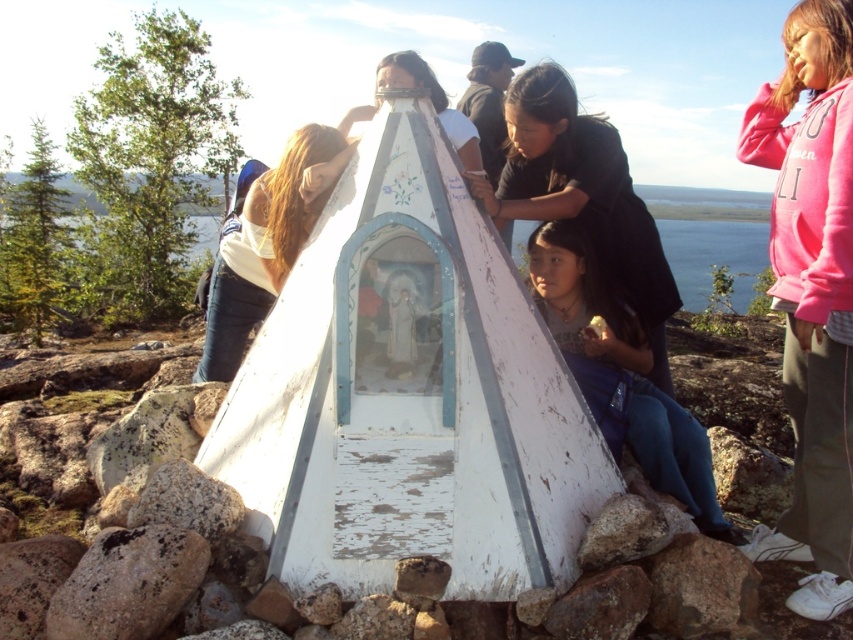
Question: Based on their relative distances, which object is nearer to the speckled granite rock at lower left?

Choices:
 (A) white chipped paint pyramid at center
 (B) matte white shirt at left
 (C) matte white statue at center
 (D) brown rough rock at lower right

Answer: (A)

Question: Is matte white statue at center closer to camera compared to matte white shirt at left?

Choices:
 (A) no
 (B) yes

Answer: (A)

Question: Which point is closer to the camera?

Choices:
 (A) speckled granite rock at lower left
 (B) white chipped paint pyramid at center

Answer: (A)

Question: Is the position of white chipped paint pyramid at center less distant than that of matte white shirt at left?

Choices:
 (A) no
 (B) yes

Answer: (B)

Question: Which of the following is the closest to the observer?

Choices:
 (A) (532, 248)
 (B) (514, 436)
 (C) (811, 339)
 (D) (157, 541)

Answer: (D)

Question: Is pink fleece jacket at upper right closer to camera compared to speckled granite rock at lower left?

Choices:
 (A) yes
 (B) no

Answer: (B)